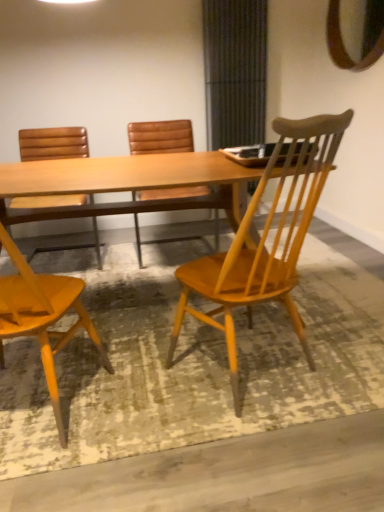
Question: Is wooden chair at center, arranged as the 4th chair when viewed from the left, completely or partially outside of matte wood chair at left, acting as the second chair starting from the left?

Choices:
 (A) yes
 (B) no

Answer: (A)

Question: Considering the relative sizes of wooden chair at center, arranged as the 4th chair when viewed from the left, and matte wood chair at left, acting as the second chair starting from the left, in the image provided, is wooden chair at center, arranged as the 4th chair when viewed from the left, wider than matte wood chair at left, acting as the second chair starting from the left,?

Choices:
 (A) yes
 (B) no

Answer: (B)

Question: Is matte wood chair at left, acting as the second chair starting from the left, located within wooden chair at center, positioned as the 1th chair in right-to-left order?

Choices:
 (A) yes
 (B) no

Answer: (B)

Question: Can you confirm if wooden chair at center, arranged as the 4th chair when viewed from the left, is positioned to the left of matte wood chair at left, acting as the second chair starting from the left?

Choices:
 (A) yes
 (B) no

Answer: (B)

Question: Is wooden chair at center, positioned as the 1th chair in right-to-left order, next to matte wood chair at left, acting as the second chair starting from the left, and touching it?

Choices:
 (A) yes
 (B) no

Answer: (B)

Question: Is point (233, 328) positioned closer to the camera than point (180, 162)?

Choices:
 (A) farther
 (B) closer

Answer: (A)

Question: Is wooden chair at center, positioned as the 1th chair in right-to-left order, bigger or smaller than light brown wood table at center?

Choices:
 (A) big
 (B) small

Answer: (B)

Question: Choose the correct answer: Is wooden chair at center, positioned as the 1th chair in right-to-left order, inside light brown wood table at center or outside it?

Choices:
 (A) inside
 (B) outside

Answer: (B)

Question: In terms of width, does wooden chair at center, arranged as the 4th chair when viewed from the left, look wider or thinner when compared to light brown wood table at center?

Choices:
 (A) wide
 (B) thin

Answer: (B)

Question: Based on their sizes in the image, would you say brown leather chair at center, which is the 3th chair in left-to-right order, is bigger or smaller than wooden chair at center, positioned as the 1th chair in right-to-left order?

Choices:
 (A) small
 (B) big

Answer: (B)

Question: From the image's perspective, is brown leather chair at center, the second chair in the right-to-left sequence, above or below wooden chair at center, positioned as the 1th chair in right-to-left order?

Choices:
 (A) above
 (B) below

Answer: (A)

Question: Is point (130, 126) closer or farther from the camera than point (281, 280)?

Choices:
 (A) closer
 (B) farther

Answer: (B)

Question: Is brown leather chair at center, which is the 3th chair in left-to-right order, inside or outside of wooden chair at center, arranged as the 4th chair when viewed from the left?

Choices:
 (A) inside
 (B) outside

Answer: (B)

Question: From a real-world perspective, relative to light brown wood table at center, is wooden mirror at upper right vertically above or below?

Choices:
 (A) below
 (B) above

Answer: (B)

Question: In the image, is wooden mirror at upper right on the left side or the right side of light brown wood table at center?

Choices:
 (A) right
 (B) left

Answer: (A)